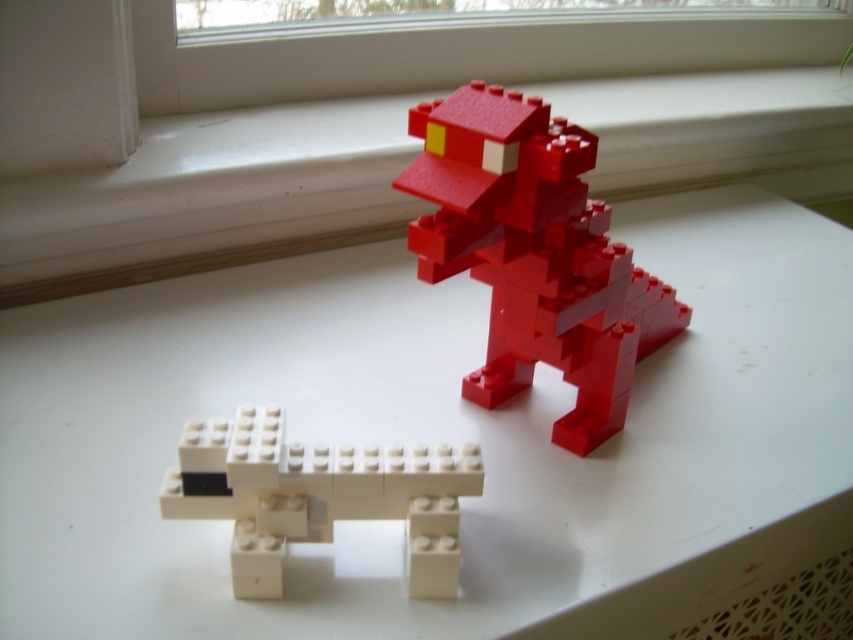
Can you confirm if white matte table at center is positioned to the left of matte plastic dinosaur at upper center?

Yes, white matte table at center is to the left of matte plastic dinosaur at upper center.

Is point (775, 422) less distant than point (614, 294)?

No, it is behind (614, 294).

Between point (743, 272) and point (582, 337), which one is positioned behind?

The point (743, 272) is more distant.

In order to click on white matte table at center in this screenshot , I will do `click(439, 440)`.

Between point (146, 472) and point (193, 232), which one is positioned in front?

Point (146, 472) is more forward.

Can you confirm if white matte table at center is shorter than white smooth window sill at upper center?

No.

Which is behind, point (740, 228) or point (71, 253)?

Point (740, 228)

Identify the location of white matte table at center. This screenshot has height=640, width=853. (439, 440).

Does matte plastic dinosaur at upper center have a lesser width compared to ivory matte/soft plastic toy horse at lower center?

In fact, matte plastic dinosaur at upper center might be wider than ivory matte/soft plastic toy horse at lower center.

Is point (611, 376) more distant than point (247, 433)?

That is True.

The height and width of the screenshot is (640, 853). Describe the element at coordinates (534, 253) in the screenshot. I see `matte plastic dinosaur at upper center` at that location.

This screenshot has width=853, height=640. I want to click on matte plastic dinosaur at upper center, so [534, 253].